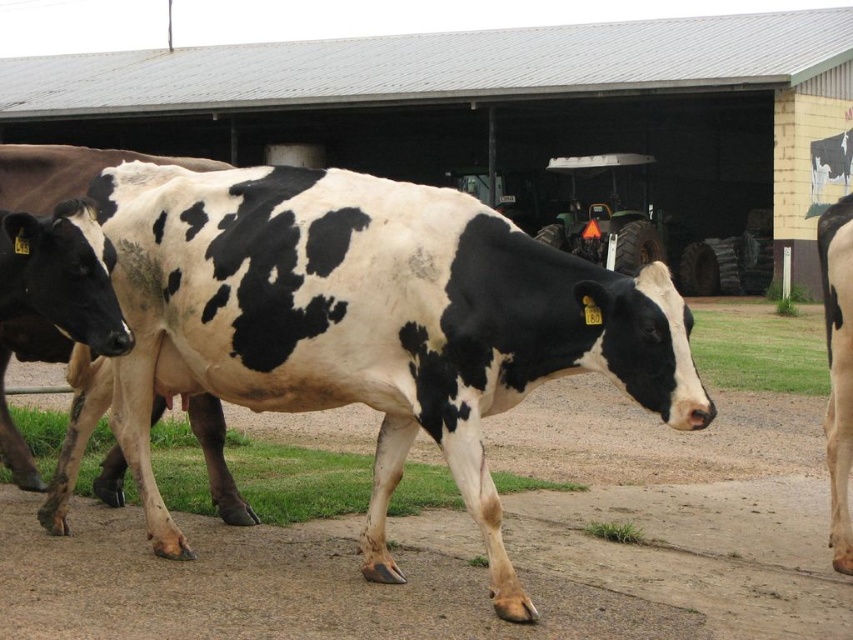
Does black and white spotted cow at center appear on the left side of black and white cow at center?

No, black and white spotted cow at center is not to the left of black and white cow at center.

Between black and white spotted cow at center and black and white cow at center, which one appears on the left side from the viewer's perspective?

Positioned to the left is black and white cow at center.

Between point (259, 387) and point (233, 106), which one is positioned in front?

Point (259, 387) is more forward.

This screenshot has height=640, width=853. I want to click on black and white spotted cow at center, so click(x=364, y=324).